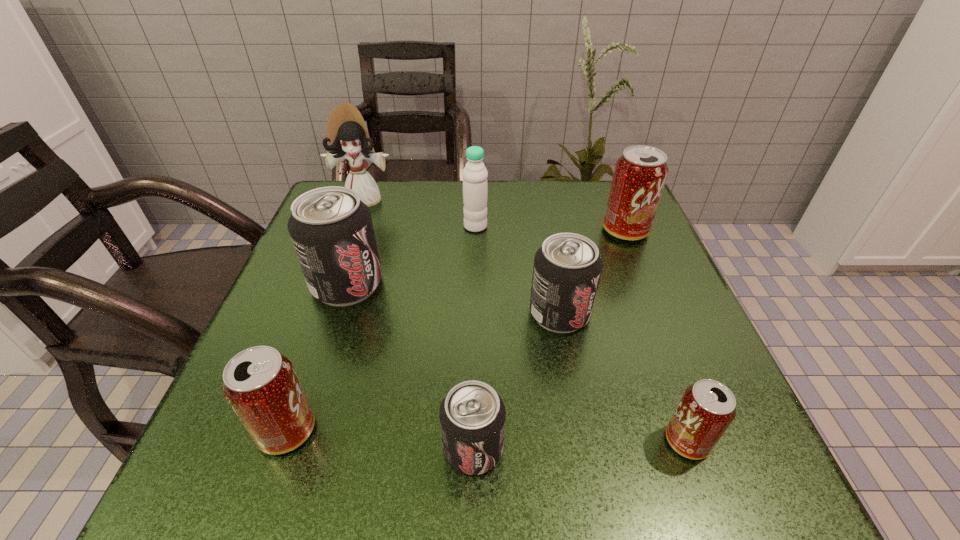
This screenshot has height=540, width=960. I want to click on the farthest object, so click(347, 136).

This screenshot has height=540, width=960. What are the coordinates of `black doll` in the screenshot? It's located at (347, 136).

This screenshot has height=540, width=960. Find the location of `white water bottle`. white water bottle is located at coordinates (475, 189).

This screenshot has height=540, width=960. Find the location of `the farthest red soda can`. the farthest red soda can is located at coordinates coord(640,174).

The height and width of the screenshot is (540, 960). I want to click on the farthest soda can, so click(640, 174).

Where is `the biggest black soda can`? The height and width of the screenshot is (540, 960). the biggest black soda can is located at coordinates (331, 229).

Identify the location of the rightmost black soda can. (567, 268).

You are a GUI agent. You are given a task and a screenshot of the screen. Output one action in this format:
    pyautogui.click(x=<x>, y=<y>)
    Task: Click on the third soda can from right to left
    This screenshot has width=960, height=540.
    Given the screenshot: What is the action you would take?
    pyautogui.click(x=567, y=268)

This screenshot has height=540, width=960. Find the location of `the second smallest red soda can`. the second smallest red soda can is located at coordinates (260, 384).

Where is `the smallest red soda can`? the smallest red soda can is located at coordinates (707, 408).